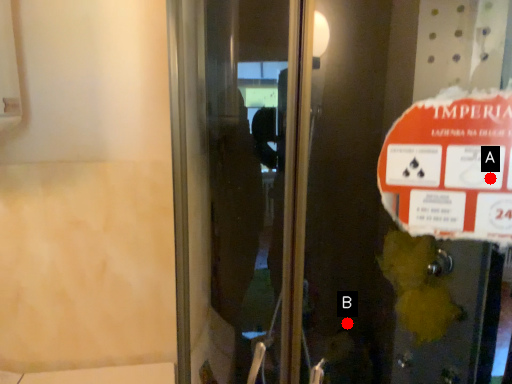
Question: Two points are circled on the image, labeled by A and B beside each circle. Which point appears closest to the camera in this image?

Choices:
 (A) A is closer
 (B) B is closer

Answer: (A)